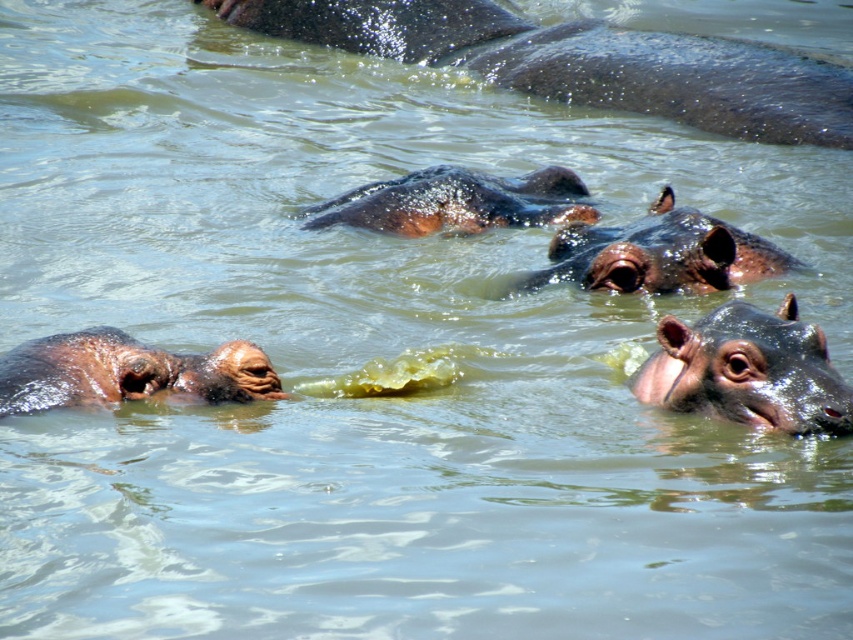
You are a photographer trying to capture both the shiny brown hippo at right and the brown matte hippo at left in a single shot. Which hippo should you adjust your camera focus on first to ensure both are in the frame?

You should focus on the shiny brown hippo at right first because the brown matte hippo at left is behind it, so adjusting focus on the closer hippo ensures both are in the frame.

You are a photographer taking pictures of the hippos. You want to capture a closeup shot of the shiny brown hippo at right and the shiny brown hippo at center. Which hippo will appear larger in your photo?

The shiny brown hippo at right will appear larger in the photo because it is closer to the viewer than the shiny brown hippo at center.